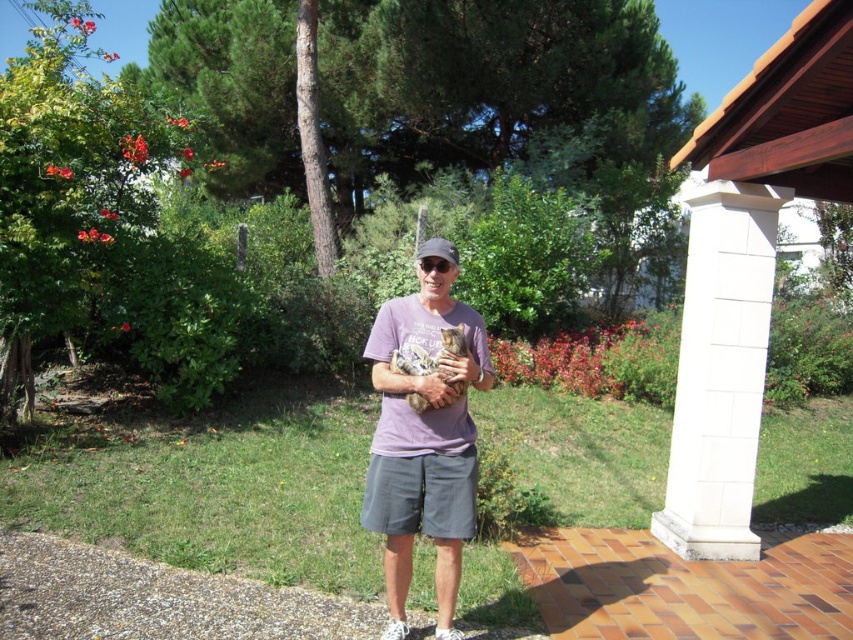
Question: Can you confirm if white textured column at right is thinner than purple cotton shirt at center?

Choices:
 (A) no
 (B) yes

Answer: (A)

Question: Which object is closer to the camera taking this photo?

Choices:
 (A) purple cotton shirt at center
 (B) matte gray baseball cap at center
 (C) white textured column at right
 (D) gray cotton shorts at center

Answer: (A)

Question: Is gray cotton shorts at center further to camera compared to matte gray baseball cap at center?

Choices:
 (A) yes
 (B) no

Answer: (B)

Question: Does white textured column at right have a greater width compared to purple cotton shirt at center?

Choices:
 (A) no
 (B) yes

Answer: (B)

Question: Which point appears closest to the camera in this image?

Choices:
 (A) (734, 493)
 (B) (422, 250)
 (C) (415, 442)
 (D) (439, 525)

Answer: (C)

Question: Estimate the real-world distances between objects in this image. Which object is farther from the matte gray baseball cap at center?

Choices:
 (A) gray cotton shorts at center
 (B) white textured column at right

Answer: (B)